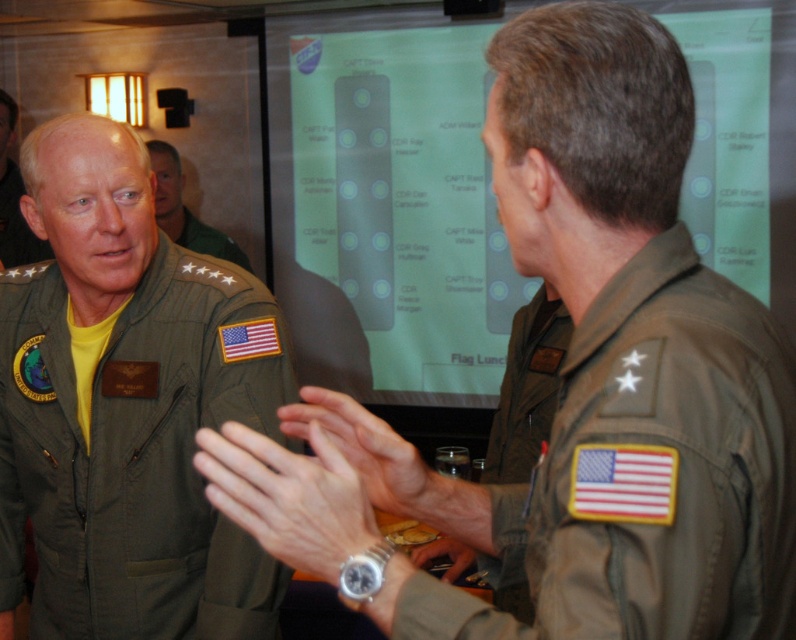
Question: Which of the following is the farthest from the observer?

Choices:
 (A) (365, 433)
 (B) (427, 548)
 (C) (205, 225)

Answer: (C)

Question: Which object is the farthest from the silver metallic watch at center?

Choices:
 (A) olive green uniform at center
 (B) green uniform at left
 (C) green uniform at center

Answer: (B)

Question: Which object is closer to the camera taking this photo?

Choices:
 (A) green fabric uniform at center
 (B) green uniform at center

Answer: (A)

Question: Does matte green uniform at center appear on the right side of metallic wristwatch at center?

Choices:
 (A) yes
 (B) no

Answer: (B)

Question: Observing the image, what is the correct spatial positioning of silver metallic watch at center in reference to green uniform at center?

Choices:
 (A) right
 (B) left

Answer: (A)

Question: Is green fabric uniform at center to the left of matte green uniform at center from the viewer's perspective?

Choices:
 (A) yes
 (B) no

Answer: (A)